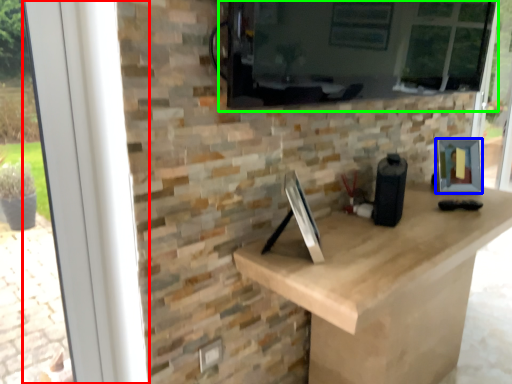
Question: Considering the real-world distances, which object is farthest from window frame (highlighted by a red box)? picture frame (highlighted by a blue box) or window screen (highlighted by a green box)?

Choices:
 (A) picture frame
 (B) window screen

Answer: (A)